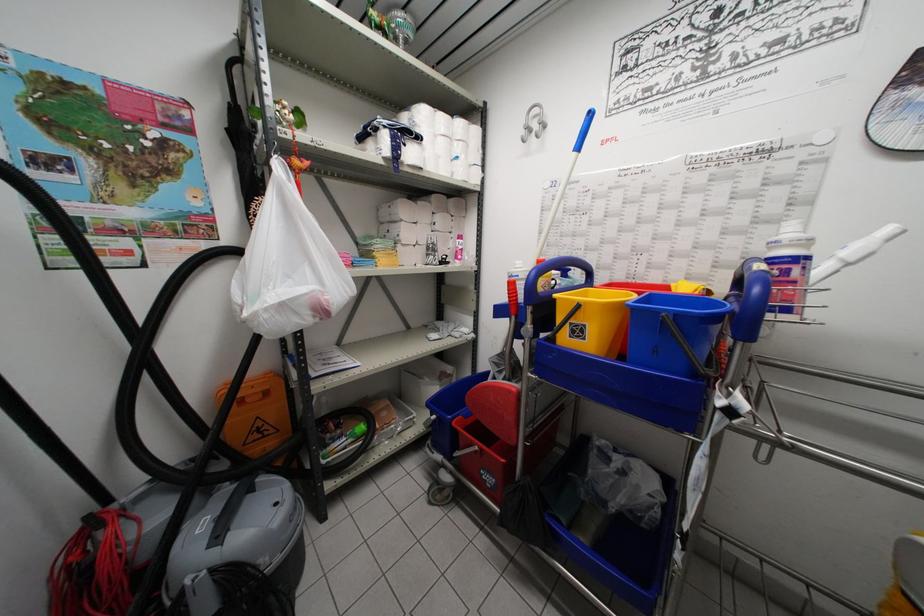
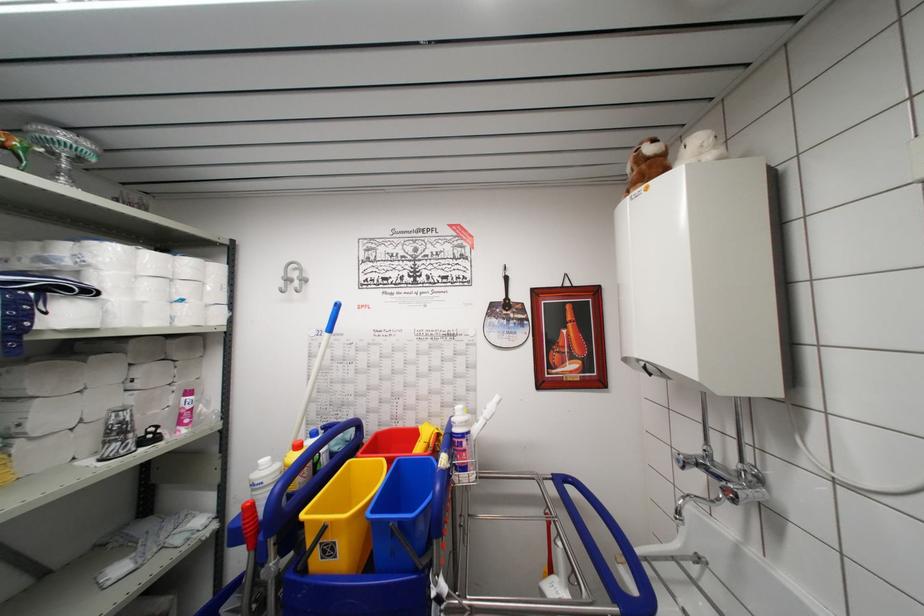
The point at (546, 124) is marked in the first image. Where is the corresponding point in the second image?

(307, 280)